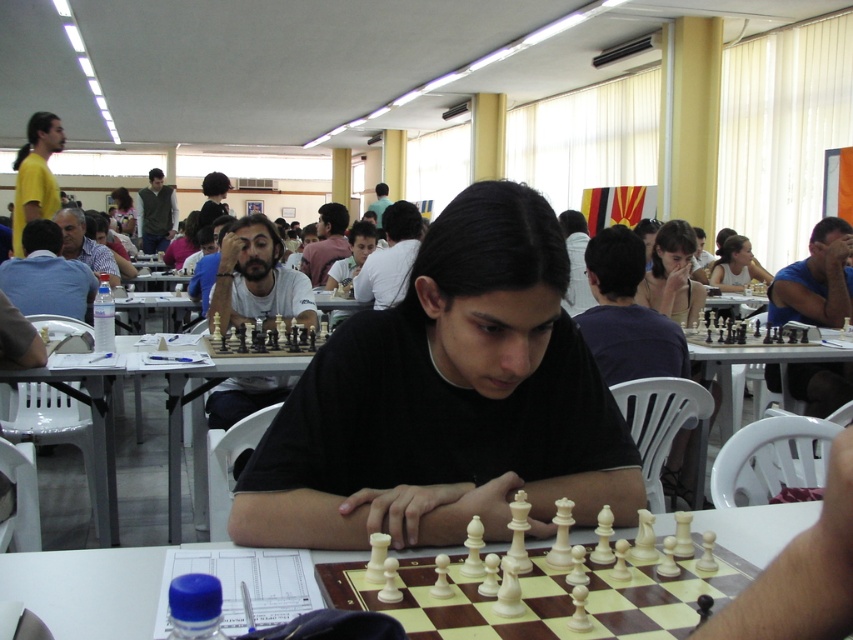
Question: Does blue cotton shirt at center appear over matte white chess piece at center?

Choices:
 (A) no
 (B) yes

Answer: (A)

Question: Which is nearer to the matte black shirt at center?

Choices:
 (A) dark gray sweater at center
 (B) matte white chess piece at center
 (C) matte blue shirt at left
 (D) blue cotton shirt at center

Answer: (A)

Question: Is white plastic table at center in front of matte black shirt at center?

Choices:
 (A) no
 (B) yes

Answer: (B)

Question: Estimate the real-world distances between objects in this image. Which object is closer to the matte white shirt at center?

Choices:
 (A) white wooden table at center
 (B) blue cotton shirt at center
 (C) black matte shirt at center

Answer: (B)

Question: Is blue cotton shirt at center bigger than white plastic chess set at center?

Choices:
 (A) yes
 (B) no

Answer: (A)

Question: Which object is the closest to the matte black shirt at center?

Choices:
 (A) matte blue shirt at left
 (B) white plastic table at center
 (C) white wooden table at center
 (D) blue cotton shirt at center

Answer: (A)